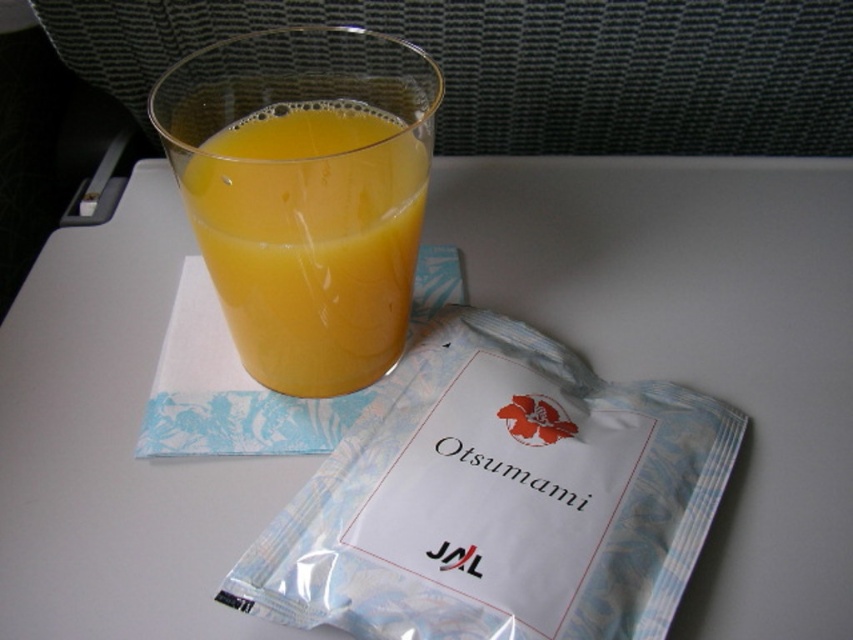
Question: Is transparent plastic pouch at upper center to the left of translucent glass at upper center from the viewer's perspective?

Choices:
 (A) no
 (B) yes

Answer: (A)

Question: Is transparent plastic pouch at upper center bigger than translucent glass at upper center?

Choices:
 (A) yes
 (B) no

Answer: (A)

Question: In this image, where is transparent plastic pouch at upper center located relative to translucent glass at upper center?

Choices:
 (A) right
 (B) left

Answer: (A)

Question: Which point is closer to the camera taking this photo?

Choices:
 (A) (341, 289)
 (B) (529, 353)

Answer: (A)

Question: Which point is closer to the camera taking this photo?

Choices:
 (A) click(386, 200)
 (B) click(299, 621)

Answer: (B)